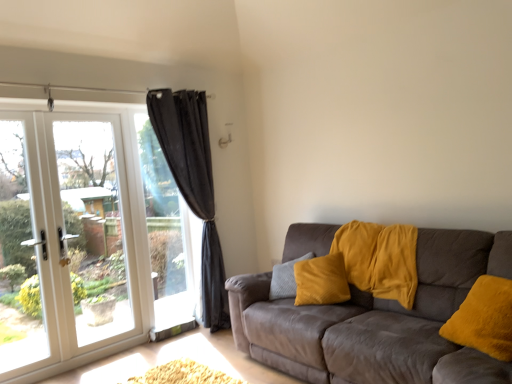
Question: From a real-world perspective, is black curtain at left positioned above or below velvet brown couch at right?

Choices:
 (A) below
 (B) above

Answer: (B)

Question: Considering the relative positions of black curtain at left and velvet brown couch at right in the image provided, is black curtain at left to the left or to the right of velvet brown couch at right?

Choices:
 (A) left
 (B) right

Answer: (A)

Question: Which object is positioned closest to the white glass door at left?

Choices:
 (A) black sheer curtain at left
 (B) velvet brown couch at right
 (C) black curtain at left

Answer: (C)

Question: Considering the real-world distances, which object is closest to the velvet brown couch at right?

Choices:
 (A) black curtain at left
 (B) white glass door at left
 (C) black sheer curtain at left

Answer: (C)